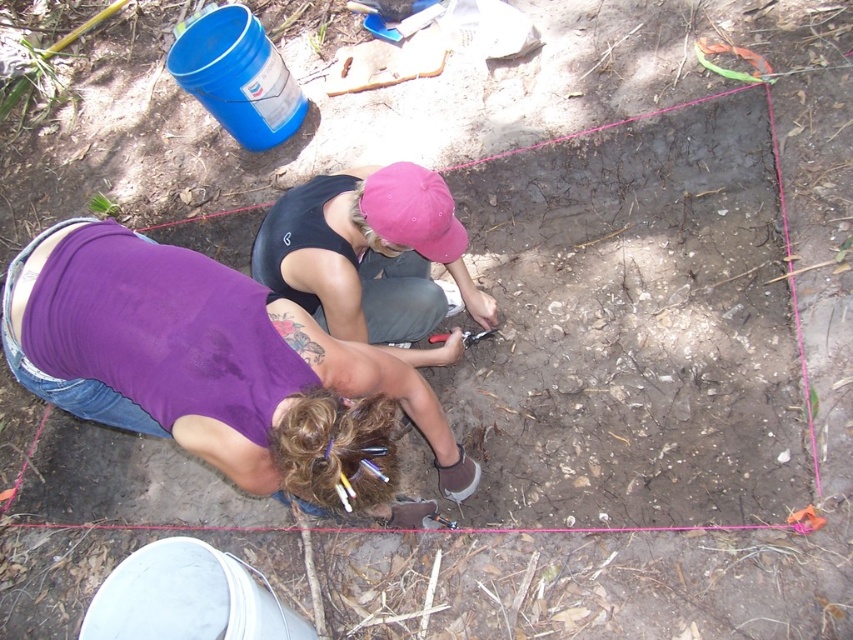
Question: Which of the following is the closest to the observer?

Choices:
 (A) purple fabric shirt at lower left
 (B) pink fabric cap at center

Answer: (A)

Question: Is purple fabric shirt at lower left smaller than pink fabric cap at center?

Choices:
 (A) no
 (B) yes

Answer: (A)

Question: Which of the following is the farthest from the observer?

Choices:
 (A) (361, 224)
 (B) (141, 392)

Answer: (A)

Question: Can you confirm if purple fabric shirt at lower left is positioned to the right of pink fabric cap at center?

Choices:
 (A) no
 (B) yes

Answer: (A)

Question: Is purple fabric shirt at lower left wider than pink fabric cap at center?

Choices:
 (A) yes
 (B) no

Answer: (A)

Question: Which object is closer to the camera taking this photo?

Choices:
 (A) pink fabric cap at center
 (B) purple fabric shirt at lower left

Answer: (B)